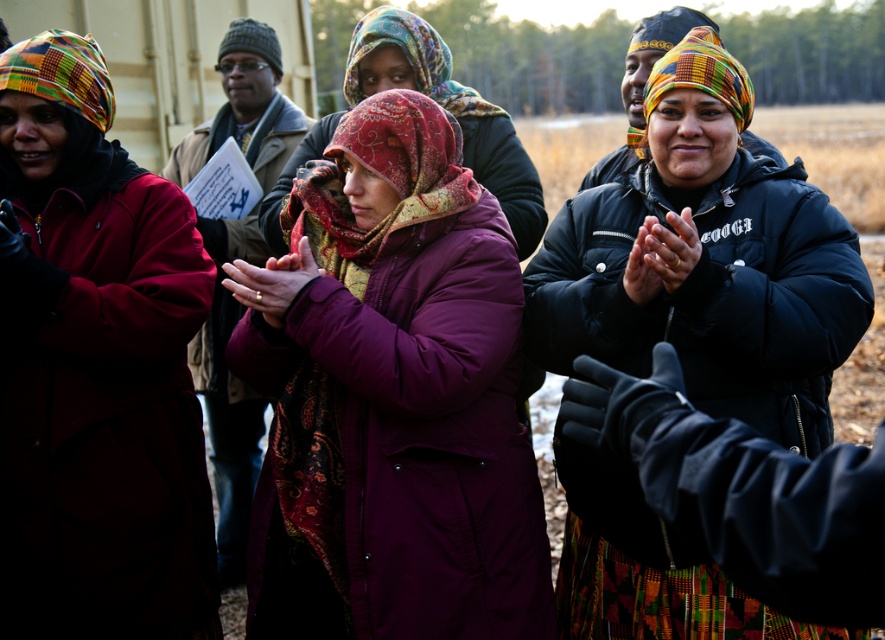
Question: Which object is closer to the camera taking this photo?

Choices:
 (A) matte red coat at left
 (B) matte black jacket at center

Answer: (B)

Question: Is purple matte coat at center smaller than purple fleece jacket at center?

Choices:
 (A) yes
 (B) no

Answer: (A)

Question: Is purple matte coat at center to the right of matte black jacket at center from the viewer's perspective?

Choices:
 (A) yes
 (B) no

Answer: (B)

Question: Which object is positioned farthest from the purple matte coat at center?

Choices:
 (A) matte black jacket at center
 (B) patterned silk headscarf at center
 (C) purple fleece jacket at center

Answer: (C)

Question: Among these objects, which one is farthest from the camera?

Choices:
 (A) multicolored woven scarf at center
 (B) purple matte coat at center

Answer: (A)

Question: Is purple matte coat at center wider than multicolored woven scarf at center?

Choices:
 (A) no
 (B) yes

Answer: (B)